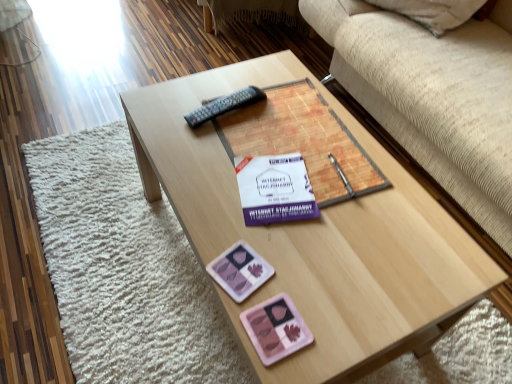
Locate an element on the screen. The width and height of the screenshot is (512, 384). vacant space underneath matte paper book at center (from a real-world perspective) is located at coordinates (292, 139).